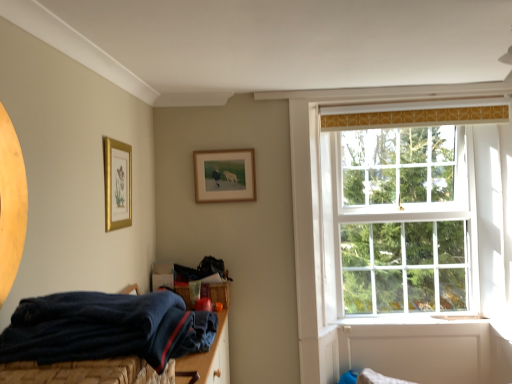
Question: From a real-world perspective, is wooden frame at upper center, the 2th picture frame in the left-to-right sequence, physically below white wooden window at upper right?

Choices:
 (A) yes
 (B) no

Answer: (B)

Question: Could you tell me if wooden frame at upper center, which is the 1th picture frame from back to front, is turned towards white wooden window at upper right?

Choices:
 (A) no
 (B) yes

Answer: (A)

Question: Considering the relative sizes of wooden frame at upper center, the 2th picture frame in the left-to-right sequence, and white wooden window at upper right in the image provided, is wooden frame at upper center, the 2th picture frame in the left-to-right sequence, bigger than white wooden window at upper right?

Choices:
 (A) no
 (B) yes

Answer: (A)

Question: Is wooden frame at upper center, placed as the 2th picture frame when sorted from front to back, outside white wooden window at upper right?

Choices:
 (A) yes
 (B) no

Answer: (A)

Question: Is wooden frame at upper center, which is counted as the 1th picture frame, starting from the right, thinner than white wooden window at upper right?

Choices:
 (A) yes
 (B) no

Answer: (A)

Question: Considering the relative sizes of wooden frame at upper center, which is counted as the 1th picture frame, starting from the right, and white wooden window at upper right in the image provided, is wooden frame at upper center, which is counted as the 1th picture frame, starting from the right, smaller than white wooden window at upper right?

Choices:
 (A) yes
 (B) no

Answer: (A)

Question: Does wooden frame at upper center, which is counted as the 1th picture frame, starting from the right, have a greater width compared to navy blue fabric bed at lower left?

Choices:
 (A) yes
 (B) no

Answer: (B)

Question: Is wooden frame at upper center, the 2th picture frame in the left-to-right sequence, not within navy blue fabric bed at lower left?

Choices:
 (A) no
 (B) yes

Answer: (B)

Question: Does wooden frame at upper center, which is the 1th picture frame from back to front, have a greater height compared to navy blue fabric bed at lower left?

Choices:
 (A) no
 (B) yes

Answer: (B)

Question: From a real-world perspective, is wooden frame at upper center, placed as the 2th picture frame when sorted from front to back, on navy blue fabric bed at lower left?

Choices:
 (A) yes
 (B) no

Answer: (A)

Question: Is the position of wooden frame at upper center, which is the 1th picture frame from back to front, more distant than that of navy blue fabric bed at lower left?

Choices:
 (A) yes
 (B) no

Answer: (A)

Question: Is wooden frame at upper center, which is counted as the 1th picture frame, starting from the right, positioned with its back to navy blue fabric bed at lower left?

Choices:
 (A) no
 (B) yes

Answer: (A)

Question: From a real-world perspective, does navy blue fabric bed at lower left sit lower than gold framed picture at upper left, the second picture frame viewed from the right?

Choices:
 (A) yes
 (B) no

Answer: (A)